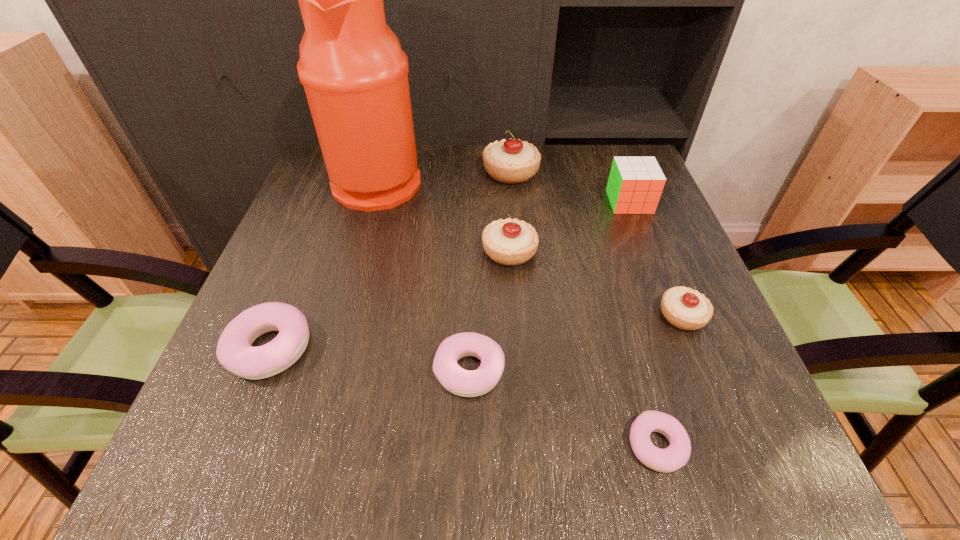
What are the coordinates of `free location that satisfies the following two spatial constraints: 1. from the spout of the water jug; 2. on the right side of the second pink pastry from right to left` in the screenshot? It's located at (324, 370).